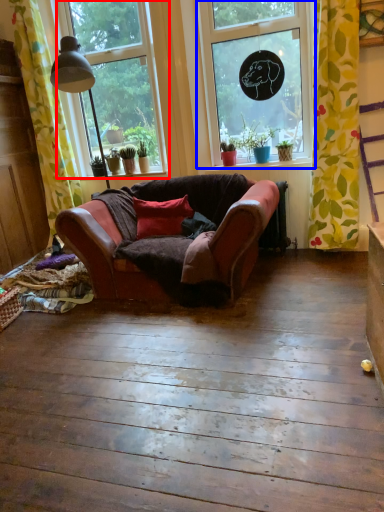
Question: Which object appears closest to the camera in this image, window (highlighted by a red box) or window (highlighted by a blue box)?

Choices:
 (A) window
 (B) window

Answer: (B)